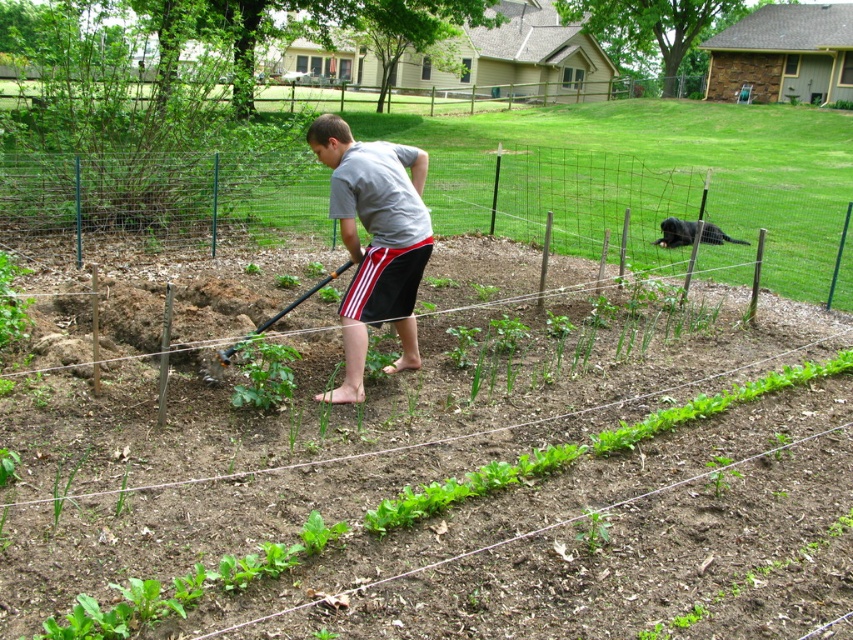
Does brushed metal shovel at center have a smaller size compared to black fur dog at upper right?

Indeed, brushed metal shovel at center has a smaller size compared to black fur dog at upper right.

Locate an element on the screen. This screenshot has height=640, width=853. brushed metal shovel at center is located at coordinates (257, 332).

Who is positioned more to the left, matte gray shirt at center or brushed metal shovel at center?

From the viewer's perspective, brushed metal shovel at center appears more on the left side.

The height and width of the screenshot is (640, 853). What do you see at coordinates (375, 241) in the screenshot? I see `matte gray shirt at center` at bounding box center [375, 241].

This screenshot has height=640, width=853. I want to click on matte gray shirt at center, so click(x=375, y=241).

Which of these two, matte gray shirt at center or black fur dog at upper right, stands shorter?

With less height is black fur dog at upper right.

I want to click on matte gray shirt at center, so click(x=375, y=241).